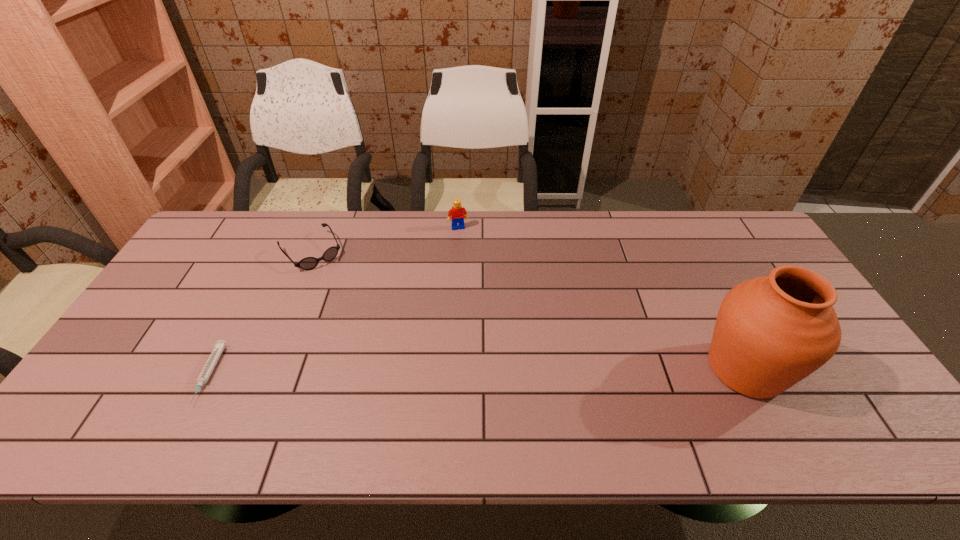
This screenshot has height=540, width=960. What are the coordinates of `free space on the desktop that is between the leftmost object and the urn and is positioned on the lenses of the third tallest object` in the screenshot? It's located at (405, 373).

I want to click on vacant space on the desktop that is between the leftmost object and the urn and is positioned on the front-facing side of the third object from left to right, so click(x=497, y=372).